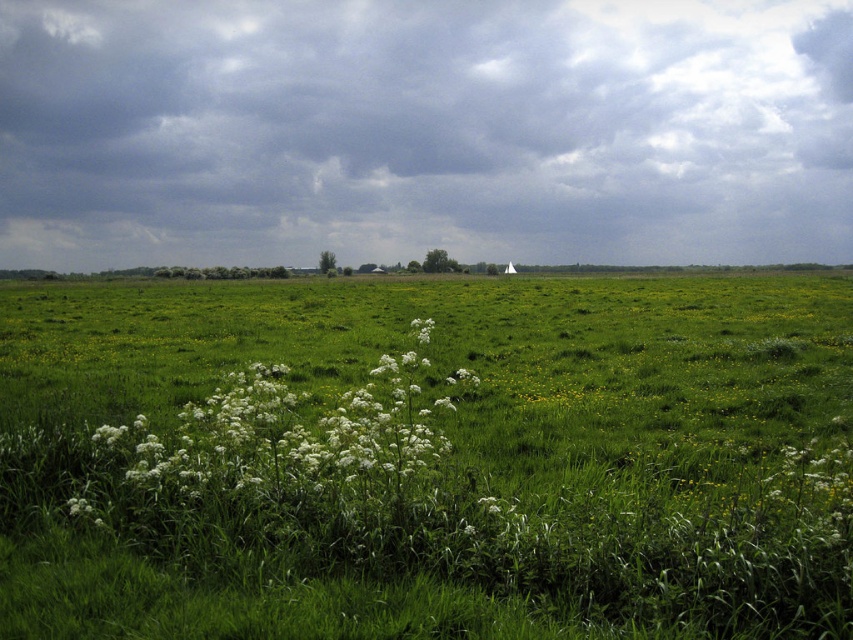
You are a photographer planning to capture the cloudy sky at center and the white fluffy plant at center in the same frame. Which object will occupy a larger portion of the image horizontally?

The cloudy sky at center has a greater width than the white fluffy plant at center, so it will occupy a larger portion of the image horizontally.

You are a hiker standing at the edge of the grassland. You see the cloudy sky at center and the white fluffy plant at center. How far apart are these two objects from each other?

The cloudy sky at center and the white fluffy plant at center are 102.52 meters apart from each other.